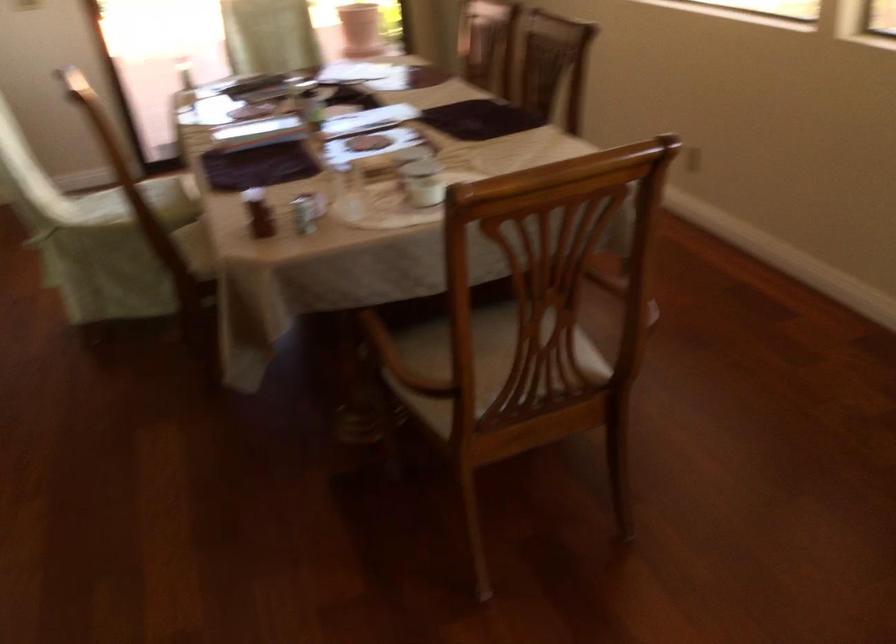
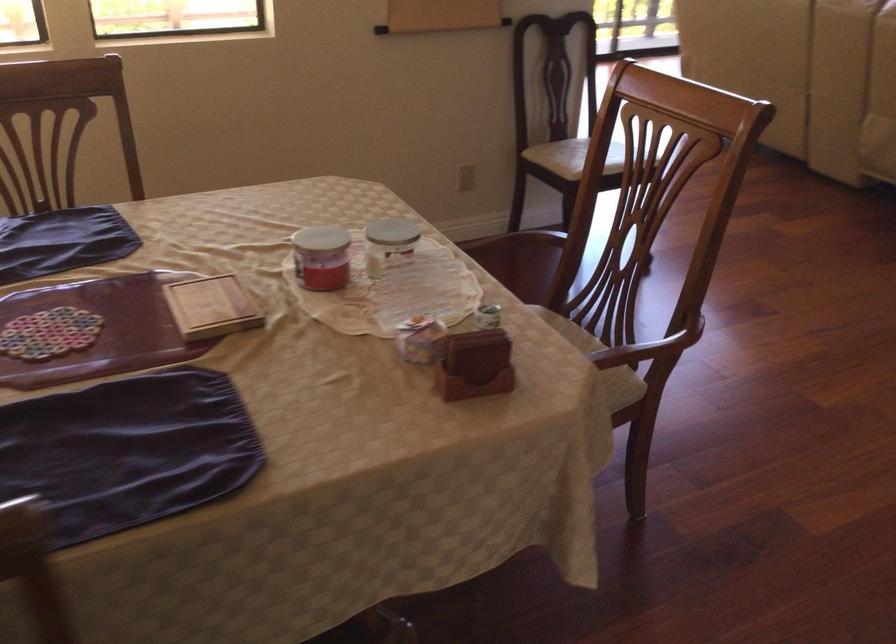
Locate, in the second image, the point that corresponds to pixel 538 375 in the first image.

(564, 322)